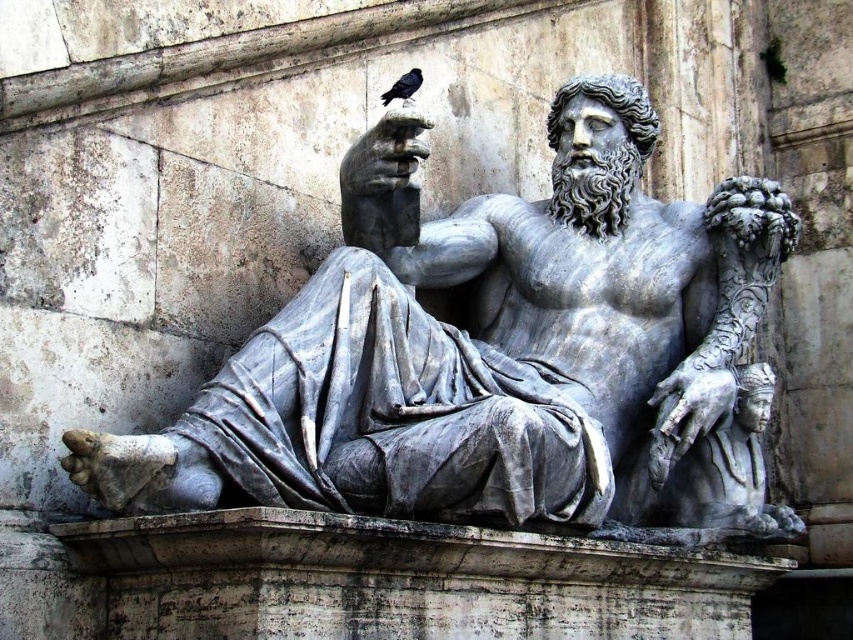
You are an ornithologist observing a black feathered bird at upper center perched on a branch. You notice a gray marble statue at center nearby. Can you determine if the bird is above or below the statue?

The gray marble statue at center is below the black feathered bird at upper center, so the bird is above the statue.

You are an art conservator examining the classical marble statue of a reclining figure. You notice a specific point at coordinates point [498,353]. Based on the statue description, can you determine where this point is located on the statue?

The point [498,353] is on the gray marble statue at center.

You are an art conservator examining the classical marble statue. You notice two points on the statue marked as point 1 at coordinates (296, 419) and point 2 at coordinates (383, 99). From your vantage point, which point is closer to you?

Point 1 at coordinates (296, 419) is closer to you because it is in front of point 2 at coordinates (383, 99).